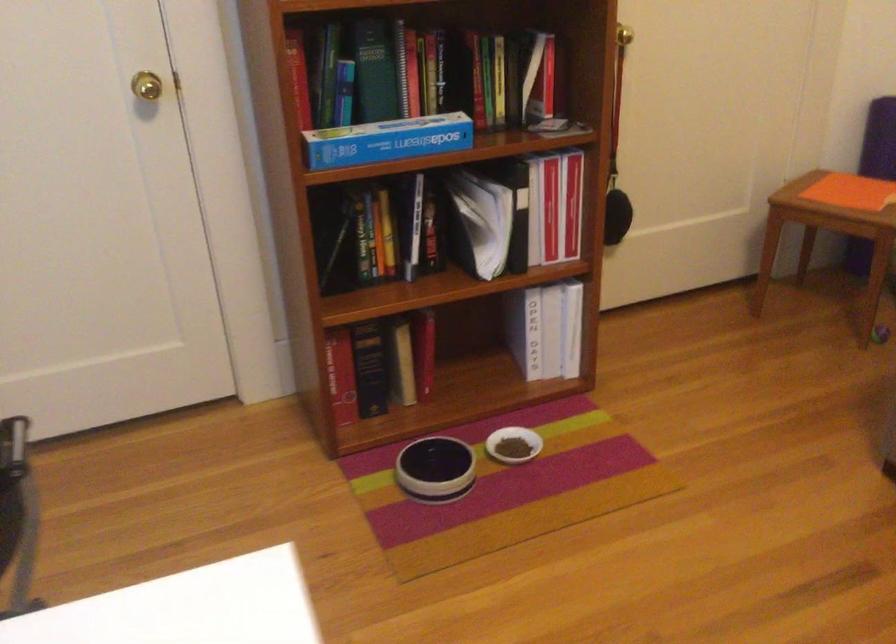
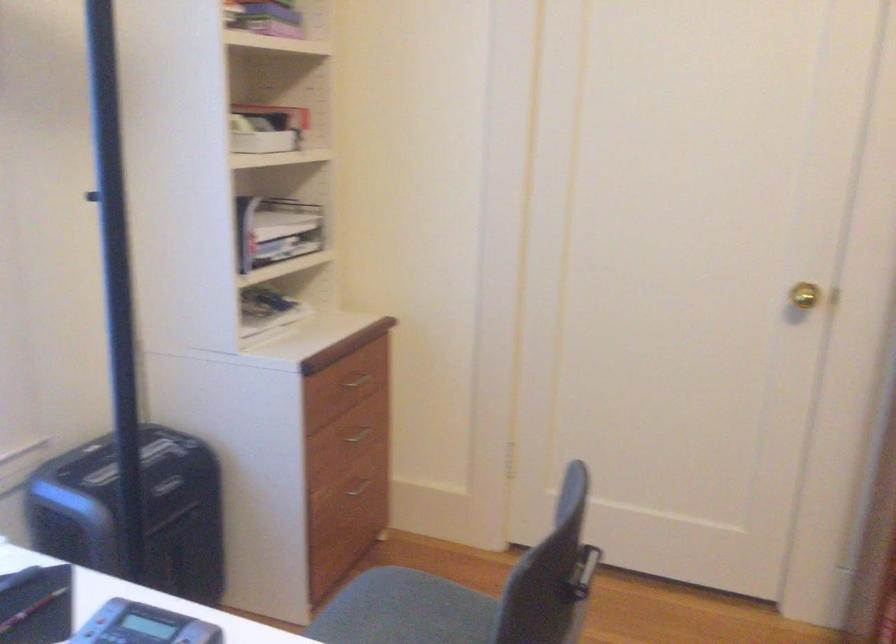
Locate, in the second image, the point that corresponds to pixel 154 82 in the first image.

(804, 295)